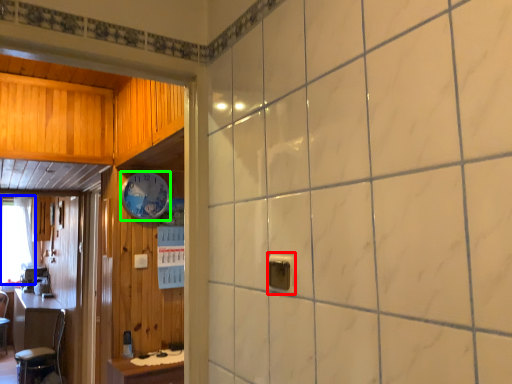
Question: Estimate the real-world distances between objects in this image. Which object is farther from electric outlet (highlighted by a red box), window (highlighted by a blue box) or clock (highlighted by a green box)?

Choices:
 (A) window
 (B) clock

Answer: (A)